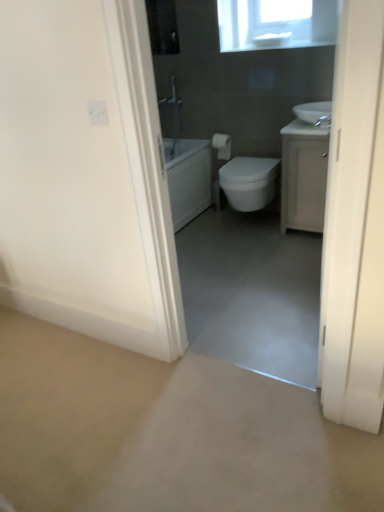
Locate an element on the screen. vacant space underneath white glossy bidet at center (from a real-world perspective) is located at coordinates (244, 225).